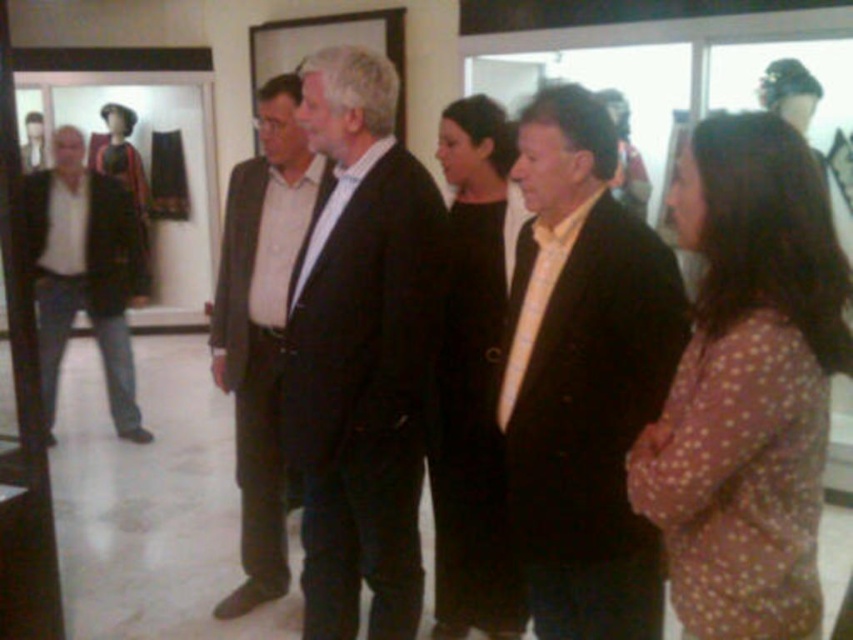
Question: Which point is farther from the camera taking this photo?

Choices:
 (A) (264, 198)
 (B) (593, 444)

Answer: (A)

Question: Does matte black jacket at center come in front of black matte coat at center?

Choices:
 (A) yes
 (B) no

Answer: (A)

Question: Which point is farther to the camera?

Choices:
 (A) matte black jacket at left
 (B) brown dotted dress at lower right
 (C) dark brown suit at center
 (D) black matte coat at center

Answer: (A)

Question: Does matte black suit at center appear under dark brown suit at center?

Choices:
 (A) yes
 (B) no

Answer: (A)

Question: Which point is farther to the camera?

Choices:
 (A) (469, 230)
 (B) (117, 353)
 (C) (415, 568)
 (D) (776, 497)

Answer: (B)

Question: Does matte black jacket at center have a smaller size compared to black matte coat at center?

Choices:
 (A) no
 (B) yes

Answer: (B)